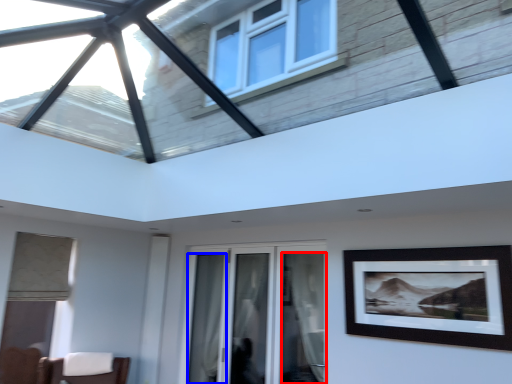
Question: Which of the following is the farthest to the observer, curtain (highlighted by a red box) or curtain (highlighted by a blue box)?

Choices:
 (A) curtain
 (B) curtain

Answer: (B)